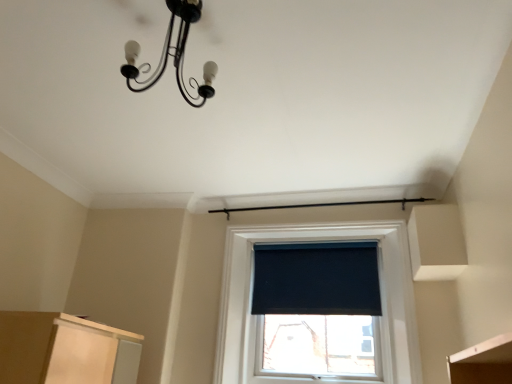
Question: Is black matte window screen at center turned away from black matte chandelier at upper center?

Choices:
 (A) no
 (B) yes

Answer: (A)

Question: Can you confirm if black matte window screen at center is positioned to the right of black matte chandelier at upper center?

Choices:
 (A) no
 (B) yes

Answer: (B)

Question: Is black matte window screen at center outside black matte chandelier at upper center?

Choices:
 (A) no
 (B) yes

Answer: (B)

Question: Does black matte window screen at center contain black matte chandelier at upper center?

Choices:
 (A) no
 (B) yes

Answer: (A)

Question: Does black matte window screen at center come in front of black matte chandelier at upper center?

Choices:
 (A) no
 (B) yes

Answer: (A)

Question: Does black matte window screen at center have a greater height compared to black matte chandelier at upper center?

Choices:
 (A) no
 (B) yes

Answer: (B)

Question: Does black matte chandelier at upper center appear on the right side of black matte window screen at center?

Choices:
 (A) no
 (B) yes

Answer: (A)

Question: Are black matte chandelier at upper center and black matte window screen at center making contact?

Choices:
 (A) no
 (B) yes

Answer: (A)

Question: Is black matte window screen at center surrounded by black matte chandelier at upper center?

Choices:
 (A) yes
 (B) no

Answer: (B)

Question: From a real-world perspective, is black matte chandelier at upper center physically below black matte window screen at center?

Choices:
 (A) no
 (B) yes

Answer: (A)

Question: From a real-world perspective, does black matte chandelier at upper center stand above black matte window screen at center?

Choices:
 (A) no
 (B) yes

Answer: (B)

Question: Is black matte chandelier at upper center outside black matte window screen at center?

Choices:
 (A) no
 (B) yes

Answer: (B)

Question: In terms of height, does black matte window screen at center look taller or shorter compared to black matte chandelier at upper center?

Choices:
 (A) tall
 (B) short

Answer: (A)